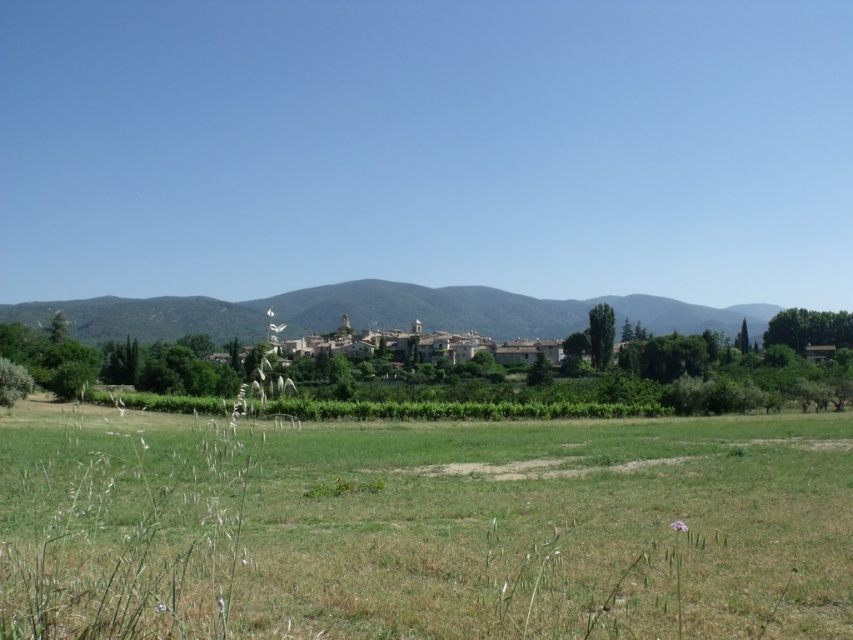
Does green grassy field at lower center appear over green grassy hill at center?

No.

Who is positioned more to the right, green grassy field at lower center or green grassy hill at center?

Positioned to the right is green grassy hill at center.

What are the coordinates of `green grassy field at lower center` in the screenshot? It's located at (424, 528).

Identify the location of green grassy field at lower center. (424, 528).